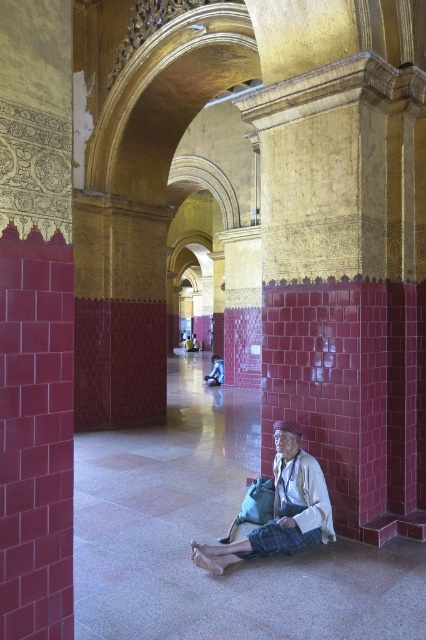
You are standing in this ornate building and see both the white fabric cloth at center and the blue fabric bag at center. Which item is closer to the floor?

The white fabric cloth at center is closer to the floor because it is positioned below the blue fabric bag at center.

You are standing in the grand ornate building and see the white fabric cloth at center and the blue fabric bag at center. If you want to place a 12 meter long decorative banner between them, will there be enough space?

The white fabric cloth at center and blue fabric bag at center are 11.79 meters apart, so the 12 meter long decorative banner will not fit between them as it is slightly longer than the distance available.